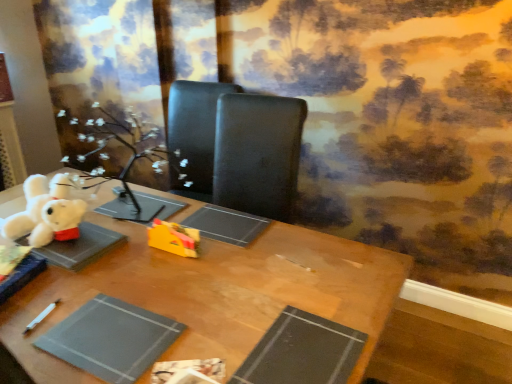
Question: From their relative heights in the image, would you say wooden table at center is taller or shorter than gray matte paper at lower left, which appears as the first paperback book when viewed from the left?

Choices:
 (A) short
 (B) tall

Answer: (B)

Question: Is point (207, 331) positioned closer to the camera than point (109, 296)?

Choices:
 (A) farther
 (B) closer

Answer: (B)

Question: Based on their relative distances, which object is nearer to the gray matte paper at lower left, which ranks as the 2th paperback book in right-to-left order?

Choices:
 (A) black matte paperback book at lower center, marked as the second paperback book in a left-to-right arrangement
 (B) white plush bear at upper left, arranged as the 1th toy when viewed from the left
 (C) yellow plastic toy at center, which appears as the second toy when viewed from the left
 (D) wooden table at center

Answer: (D)

Question: Which object is the farthest from the white plush bear at upper left, arranged as the 1th toy when viewed from the left?

Choices:
 (A) gray matte paper at lower left, which appears as the first paperback book when viewed from the left
 (B) wooden table at center
 (C) yellow plastic toy at center, which appears as the second toy when viewed from the left
 (D) black matte paperback book at lower center, marked as the second paperback book in a left-to-right arrangement

Answer: (D)